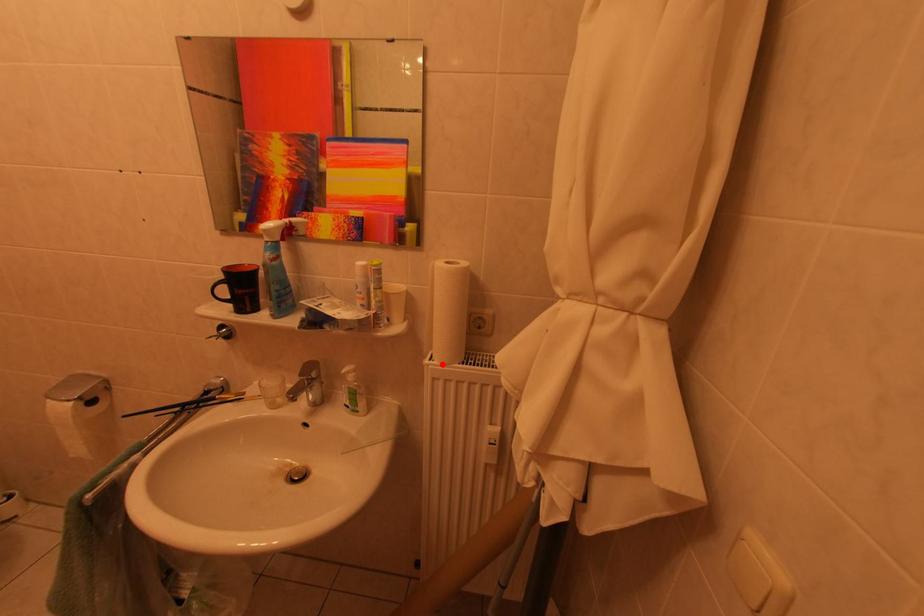
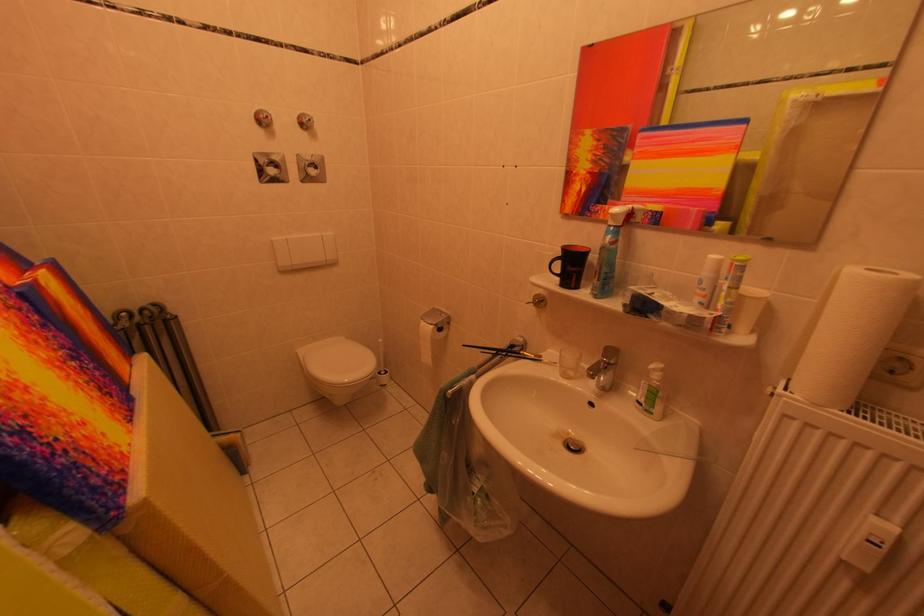
The point at the highlighted location is marked in the first image. Where is the corresponding point in the second image?

(800, 397)